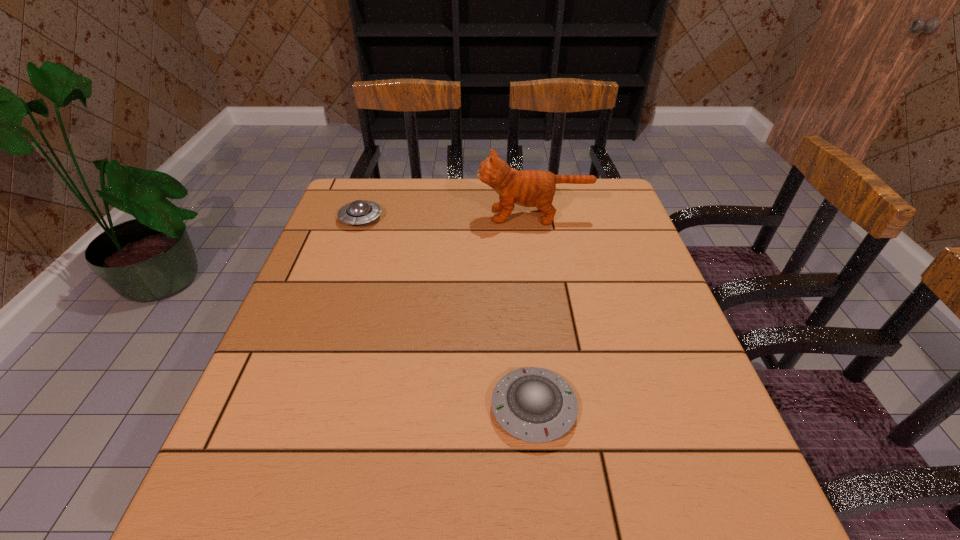
This screenshot has width=960, height=540. In the image, there is a desktop. Find the location of `blank space at the far left corner`. blank space at the far left corner is located at coordinates (388, 178).

This screenshot has width=960, height=540. Identify the location of free spot at the near left corner of the desktop. (204, 500).

You are a GUI agent. You are given a task and a screenshot of the screen. Output one action in this format:
    pyautogui.click(x=<x>, y=<y>)
    Task: Click on the free space at the far right corner of the desktop
    This screenshot has width=960, height=540.
    Given the screenshot: What is the action you would take?
    pyautogui.click(x=616, y=188)

Find the location of a particular element. free spot between the shorter saucer and the tallest object is located at coordinates (534, 312).

Locate an element on the screen. empty location between the nearer saucer and the farther saucer is located at coordinates (447, 313).

What are the coordinates of `free space that is in between the right saucer and the tallest object` in the screenshot? It's located at (534, 312).

This screenshot has width=960, height=540. Identify the location of free space between the cat and the nearer saucer. (534, 312).

You are a GUI agent. You are given a task and a screenshot of the screen. Output one action in this format:
    pyautogui.click(x=<x>, y=<y>)
    Task: Click on the free spot between the shortest object and the cat
    This screenshot has width=960, height=540.
    Given the screenshot: What is the action you would take?
    pyautogui.click(x=534, y=312)

Where is `free space that is in between the taller saucer and the nearer saucer`? The width and height of the screenshot is (960, 540). free space that is in between the taller saucer and the nearer saucer is located at coordinates (447, 313).

You are a GUI agent. You are given a task and a screenshot of the screen. Output one action in this format:
    pyautogui.click(x=<x>, y=<y>)
    Task: Click on the vacant space in between the shortest object and the leftmost object
    This screenshot has height=540, width=960.
    Given the screenshot: What is the action you would take?
    pyautogui.click(x=447, y=313)